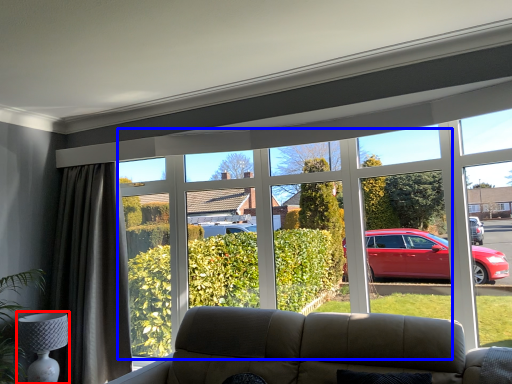
Question: Which of the following is the closest to the observer, lamp (highlighted by a red box) or bay window (highlighted by a blue box)?

Choices:
 (A) lamp
 (B) bay window

Answer: (B)